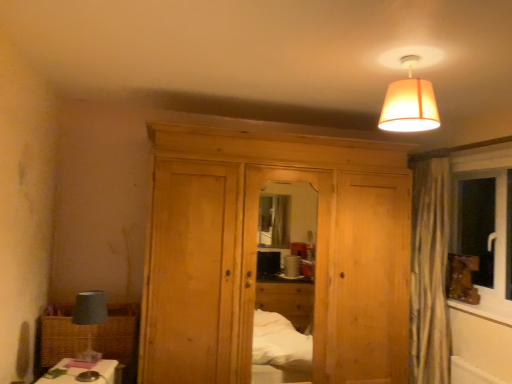
Question: Should I look upward or downward to see woven brown picnic basket at lower left?

Choices:
 (A) down
 (B) up

Answer: (A)

Question: Does orange fabric lampshade at upper center come in front of natural wood dresser at center?

Choices:
 (A) yes
 (B) no

Answer: (A)

Question: From the image's perspective, would you say orange fabric lampshade at upper center is positioned over natural wood dresser at center?

Choices:
 (A) no
 (B) yes

Answer: (B)

Question: Can you confirm if orange fabric lampshade at upper center is wider than natural wood dresser at center?

Choices:
 (A) yes
 (B) no

Answer: (B)

Question: Does orange fabric lampshade at upper center lie behind natural wood dresser at center?

Choices:
 (A) no
 (B) yes

Answer: (A)

Question: Can you confirm if orange fabric lampshade at upper center is shorter than natural wood dresser at center?

Choices:
 (A) no
 (B) yes

Answer: (B)

Question: Does orange fabric lampshade at upper center have a greater height compared to natural wood dresser at center?

Choices:
 (A) yes
 (B) no

Answer: (B)

Question: Is matte gray lampshade at left to the left of wooden frame at right from the viewer's perspective?

Choices:
 (A) yes
 (B) no

Answer: (A)

Question: From a real-world perspective, is matte gray lampshade at left on top of wooden frame at right?

Choices:
 (A) yes
 (B) no

Answer: (B)

Question: From the image's perspective, is matte gray lampshade at left on top of wooden frame at right?

Choices:
 (A) yes
 (B) no

Answer: (A)

Question: Does matte gray lampshade at left have a smaller size compared to wooden frame at right?

Choices:
 (A) yes
 (B) no

Answer: (B)

Question: Can you confirm if matte gray lampshade at left is taller than wooden frame at right?

Choices:
 (A) no
 (B) yes

Answer: (B)

Question: Are matte gray lampshade at left and wooden frame at right located far from each other?

Choices:
 (A) no
 (B) yes

Answer: (B)

Question: Is orange fabric lampshade at upper center at the left side of wooden frame at right?

Choices:
 (A) yes
 (B) no

Answer: (A)